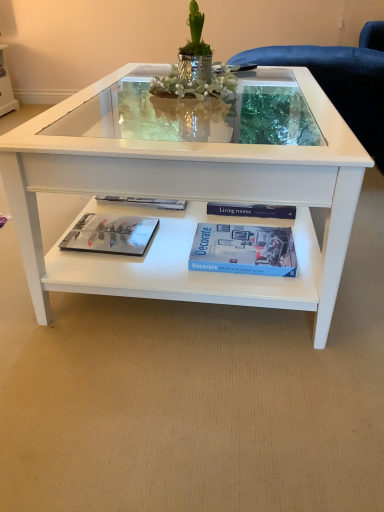
Question: From a real-world perspective, relative to white glossy coffee table at center, is blue matte book at center vertically above or below?

Choices:
 (A) below
 (B) above

Answer: (A)

Question: Based on their sizes in the image, would you say blue matte book at center is bigger or smaller than white glossy coffee table at center?

Choices:
 (A) small
 (B) big

Answer: (A)

Question: Which of these objects is positioned closest to the matte glossy magazine at lower left?

Choices:
 (A) blue matte book at center
 (B) white glossy coffee table at center

Answer: (A)

Question: Estimate the real-world distances between objects in this image. Which object is farther from the blue matte book at center?

Choices:
 (A) white glossy coffee table at center
 (B) matte glossy magazine at lower left

Answer: (B)